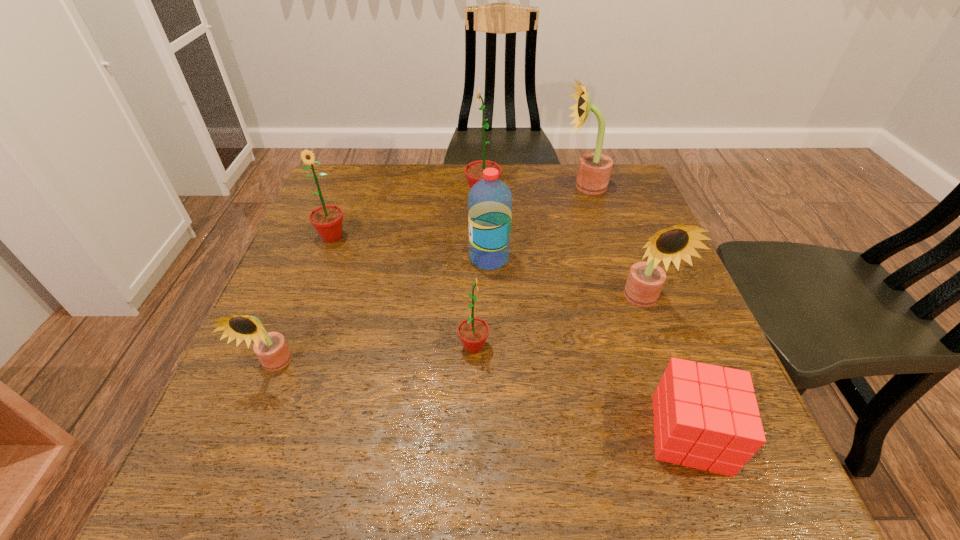
Locate which yellow sunflower ranks in proximity to the nearest yellow sunflower. Please provide its 2D coordinates. Your answer should be formatted as a tuple, i.e. [(x, y)], where the tuple contains the x and y coordinates of a point satisfying the conditions above.

[(645, 281)]

Locate which yellow sunflower ranks second in proximity to the second smallest yellow sunflower. Please provide its 2D coordinates. Your answer should be formatted as a tuple, i.e. [(x, y)], where the tuple contains the x and y coordinates of a point satisfying the conditions above.

[(271, 348)]

Identify which green sunflower is the third nearest to the second nearest yellow sunflower. Please provide its 2D coordinates. Your answer should be formatted as a tuple, i.e. [(x, y)], where the tuple contains the x and y coordinates of a point satisfying the conditions above.

[(327, 220)]

Where is `green sunflower that stands as the third closest to the second nearest yellow sunflower`? green sunflower that stands as the third closest to the second nearest yellow sunflower is located at coordinates (327, 220).

This screenshot has height=540, width=960. I want to click on vacant space that satisfies the following two spatial constraints: 1. on the face of the smallest green sunflower; 2. on the face of the smallest yellow sunflower, so click(x=473, y=364).

Where is `vacant space that satisfies the following two spatial constraints: 1. on the face of the farthest green sunflower; 2. on the face of the second biggest green sunflower`? The image size is (960, 540). vacant space that satisfies the following two spatial constraints: 1. on the face of the farthest green sunflower; 2. on the face of the second biggest green sunflower is located at coordinates (484, 237).